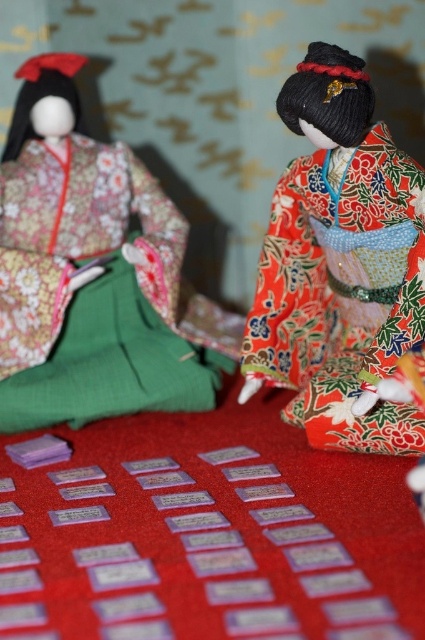
Question: Is matte floral kimono at left thinner than shiny red kimono at right?

Choices:
 (A) yes
 (B) no

Answer: (B)

Question: Which of the following is the closest to the observer?

Choices:
 (A) (53, 72)
 (B) (388, 305)

Answer: (B)

Question: Which point is closer to the camera taking this photo?

Choices:
 (A) (354, 438)
 (B) (141, 372)

Answer: (A)

Question: In this image, where is matte floral kimono at left located relative to shiny red kimono at right?

Choices:
 (A) above
 (B) below

Answer: (A)

Question: Does matte floral kimono at left have a smaller size compared to shiny red kimono at right?

Choices:
 (A) no
 (B) yes

Answer: (A)

Question: Among these points, which one is farthest from the camera?

Choices:
 (A) (308, 243)
 (B) (155, 280)

Answer: (B)